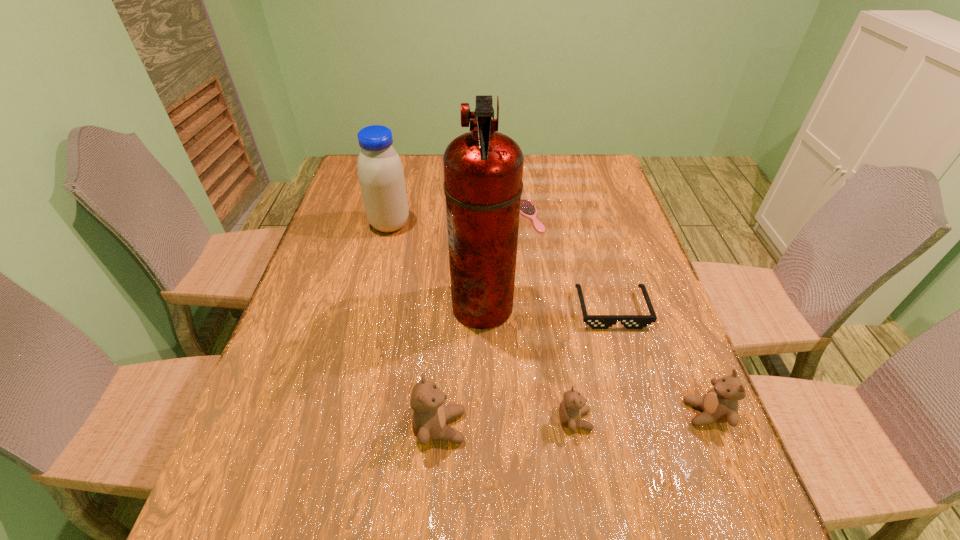
Locate an element on the screen. the tallest teddy bear is located at coordinates (429, 419).

You are a GUI agent. You are given a task and a screenshot of the screen. Output one action in this format:
    pyautogui.click(x=<x>, y=<y>)
    Task: Click on the leftmost teddy bear
    
    Given the screenshot: What is the action you would take?
    pyautogui.click(x=429, y=419)

This screenshot has height=540, width=960. What are the coordinates of `the third shortest object` in the screenshot? It's located at (572, 407).

The image size is (960, 540). Find the location of `the shortest teddy bear`. the shortest teddy bear is located at coordinates (572, 407).

Locate an element on the screen. Image resolution: width=960 pixels, height=540 pixels. the rightmost object is located at coordinates (720, 404).

The width and height of the screenshot is (960, 540). I want to click on the rightmost teddy bear, so click(720, 404).

You are a GUI agent. You are given a task and a screenshot of the screen. Output one action in this format:
    pyautogui.click(x=<x>, y=<y>)
    Task: Click on the soya milk
    Image resolution: width=960 pixels, height=540 pixels.
    Given the screenshot: What is the action you would take?
    pyautogui.click(x=381, y=176)

You are a GUI agent. You are given a task and a screenshot of the screen. Output one action in this format:
    pyautogui.click(x=<x>, y=<y>)
    Task: Click on the sixth shortest object
    This screenshot has height=540, width=960.
    Given the screenshot: What is the action you would take?
    click(381, 176)

Locate an element on the screen. hairbrush is located at coordinates (527, 208).

The height and width of the screenshot is (540, 960). I want to click on fire extinguisher, so click(483, 169).